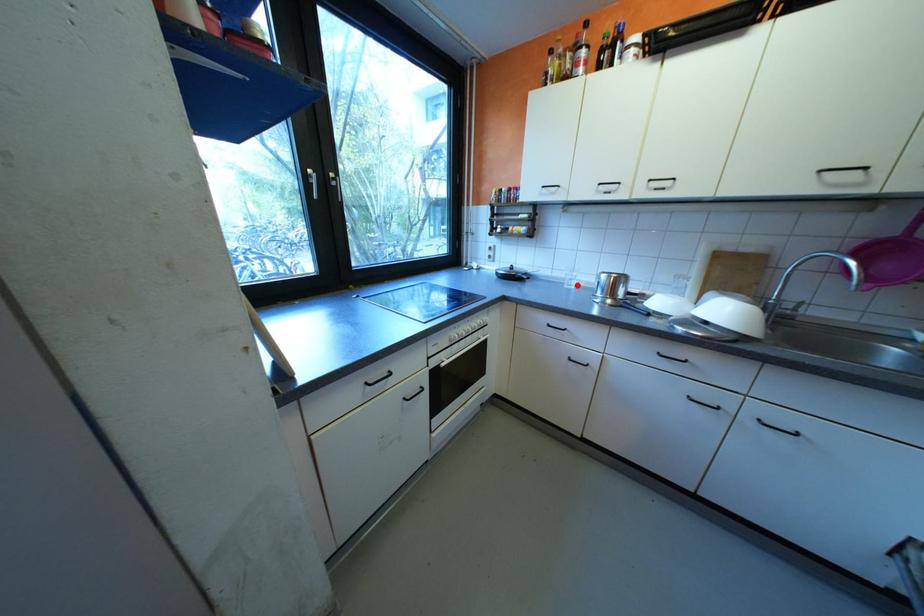
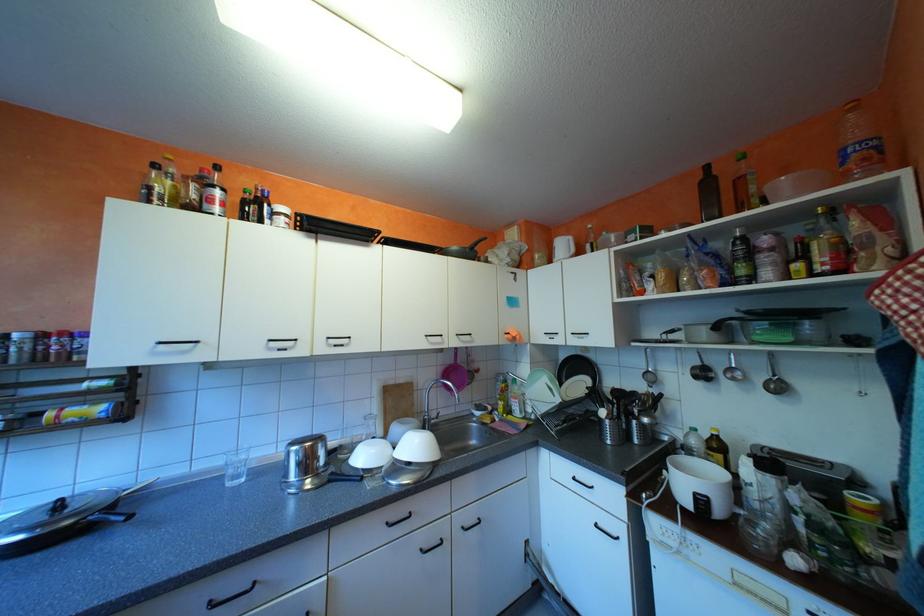
Where in the second image is the point corresponding to the highlighted location from the first image?

(239, 483)